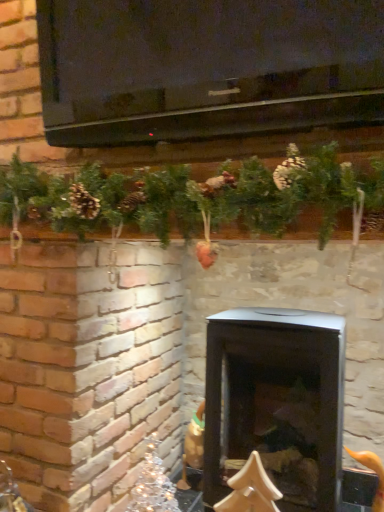
Question: Is black matte wood burning stove at center smaller than iridescent glass ornament at lower left?

Choices:
 (A) yes
 (B) no

Answer: (B)

Question: Is black matte wood burning stove at center located outside iridescent glass ornament at lower left?

Choices:
 (A) no
 (B) yes

Answer: (B)

Question: Is black matte wood burning stove at center facing towards iridescent glass ornament at lower left?

Choices:
 (A) yes
 (B) no

Answer: (B)

Question: Does black matte wood burning stove at center lie in front of iridescent glass ornament at lower left?

Choices:
 (A) yes
 (B) no

Answer: (A)

Question: Can you confirm if black matte wood burning stove at center is taller than iridescent glass ornament at lower left?

Choices:
 (A) yes
 (B) no

Answer: (A)

Question: Is black matte wood burning stove at center positioned with its back to iridescent glass ornament at lower left?

Choices:
 (A) yes
 (B) no

Answer: (B)

Question: Is iridescent glass ornament at lower left not near black matte wood burning stove at center?

Choices:
 (A) no
 (B) yes

Answer: (A)

Question: Is iridescent glass ornament at lower left looking in the opposite direction of black matte wood burning stove at center?

Choices:
 (A) yes
 (B) no

Answer: (B)

Question: Can you confirm if iridescent glass ornament at lower left is positioned to the left of black matte wood burning stove at center?

Choices:
 (A) yes
 (B) no

Answer: (A)

Question: Can you confirm if iridescent glass ornament at lower left is bigger than black matte wood burning stove at center?

Choices:
 (A) yes
 (B) no

Answer: (B)

Question: Is iridescent glass ornament at lower left in contact with black matte wood burning stove at center?

Choices:
 (A) no
 (B) yes

Answer: (A)

Question: Does iridescent glass ornament at lower left come behind black matte wood burning stove at center?

Choices:
 (A) yes
 (B) no

Answer: (A)

Question: Considering the positions of iridescent glass ornament at lower left and black matte wood burning stove at center in the image, is iridescent glass ornament at lower left wider or thinner than black matte wood burning stove at center?

Choices:
 (A) wide
 (B) thin

Answer: (B)